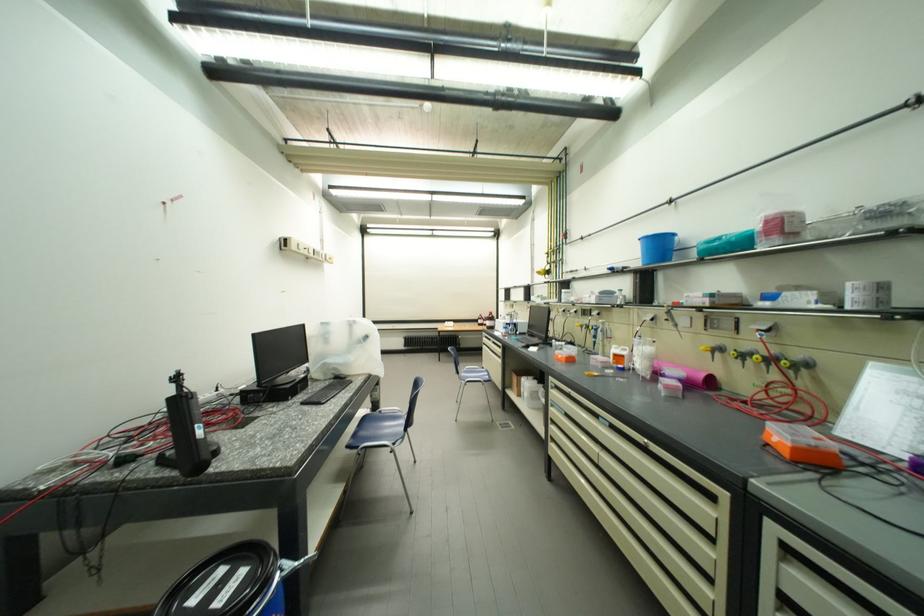
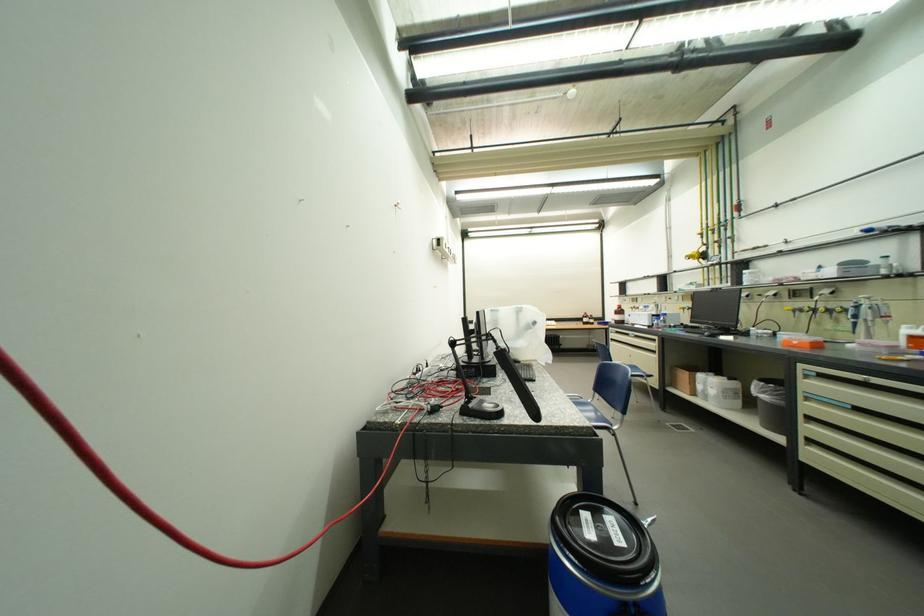
Question: In a continuous first-person perspective shot, in which direction is the camera moving?

Choices:
 (A) Left
 (B) Right
 (C) Forward
 (D) Backward

Answer: (A)